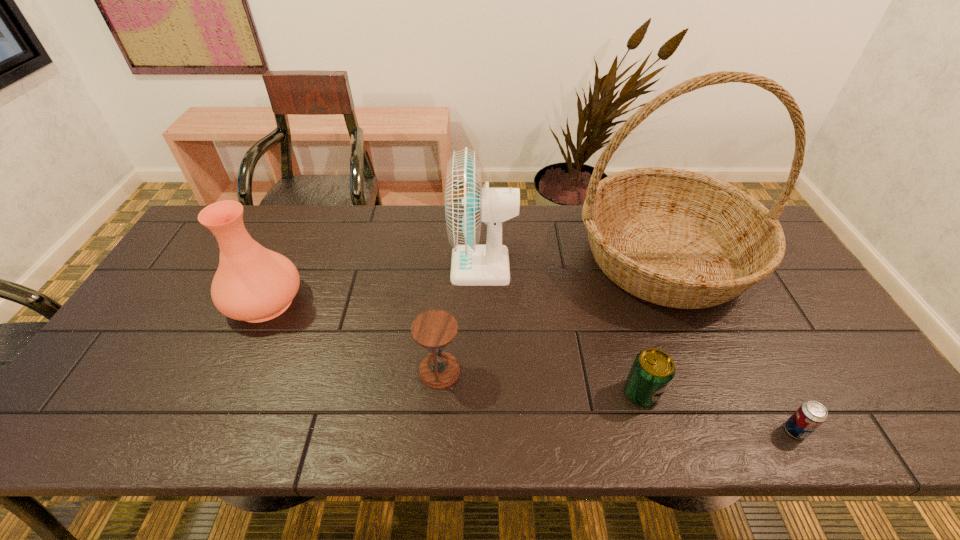
Where is `the tallest object`? the tallest object is located at coordinates (676, 238).

The width and height of the screenshot is (960, 540). I want to click on fan, so click(x=467, y=204).

This screenshot has width=960, height=540. I want to click on the third tallest object, so click(254, 284).

Where is `the leftmost object`? The image size is (960, 540). the leftmost object is located at coordinates (254, 284).

This screenshot has width=960, height=540. What are the coordinates of `hourglass` in the screenshot? It's located at (435, 329).

Where is `the left beer can`? The image size is (960, 540). the left beer can is located at coordinates (652, 371).

The image size is (960, 540). Identify the location of the second shortest object. (652, 371).

Locate an element on the screen. Image resolution: width=960 pixels, height=540 pixels. the shortest object is located at coordinates (810, 415).

Where is `the nearest object`? the nearest object is located at coordinates 810,415.

Identify the location of vacant space positioned 0.250m on the left of the tallest object. (492, 258).